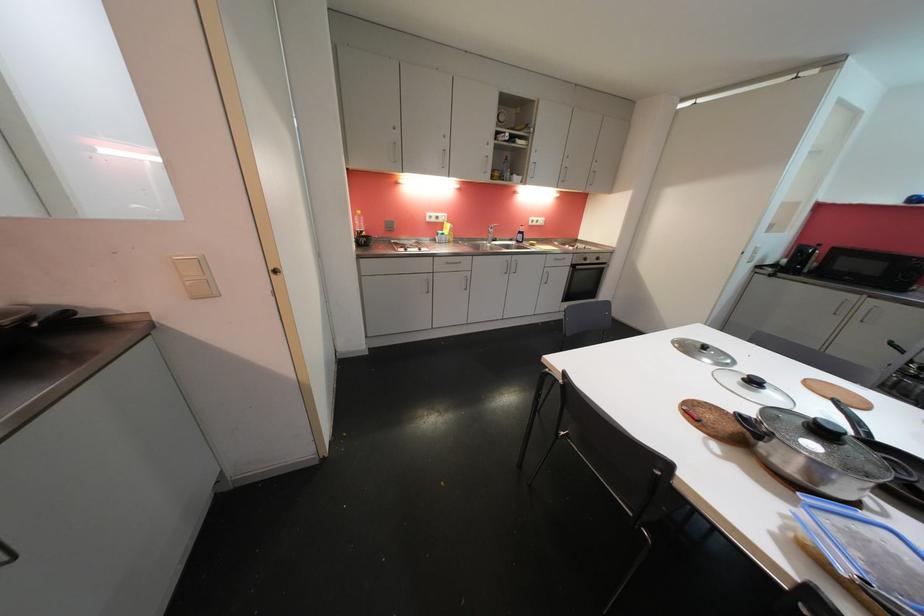
Find where to lift the black lid handle. Please return your answer as a coordinate pair (x, y).

(749, 426)